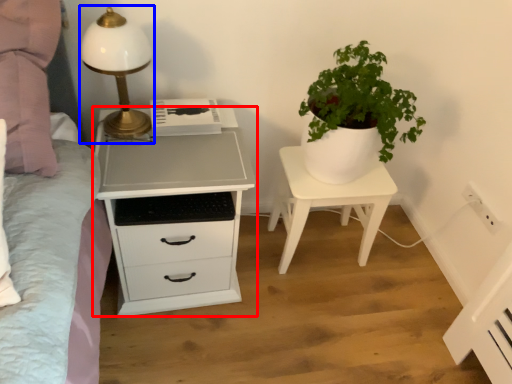
Question: Among these objects, which one is farthest to the camera, chest of drawers (highlighted by a red box) or table lamp (highlighted by a blue box)?

Choices:
 (A) chest of drawers
 (B) table lamp

Answer: (A)